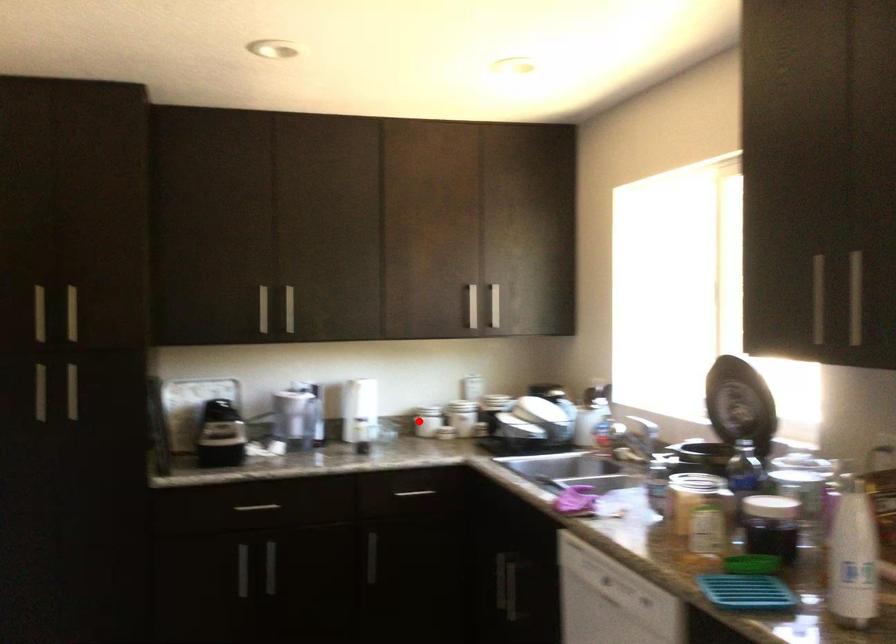
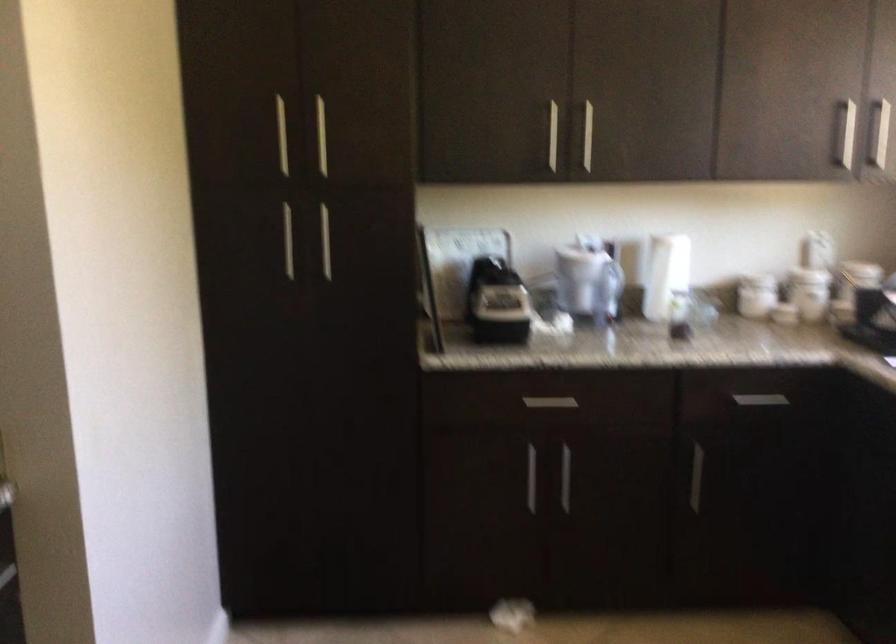
Question: I am providing you with two images of the same scene from different viewpoints. Given a red point in image1, look at the same physical point in image2. Is it:

Choices:
 (A) Closer to the viewpoint
 (B) Farther from the viewpoint

Answer: (A)